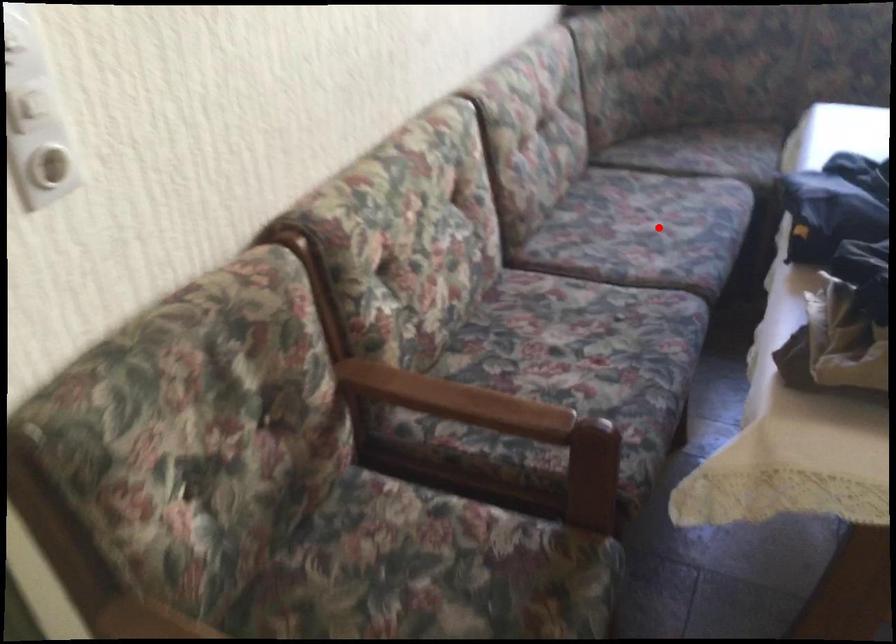
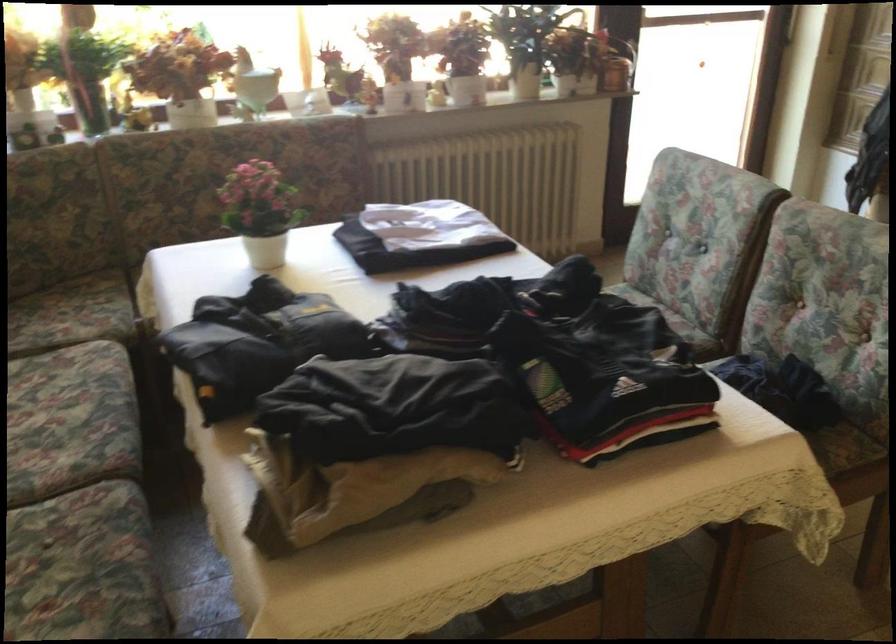
Question: I am providing you with two images of the same scene from different viewpoints. In image1, a red point is highlighted. Considering the same 3D point in image2, which of the following is correct?

Choices:
 (A) It is closer
 (B) It is farther

Answer: (A)